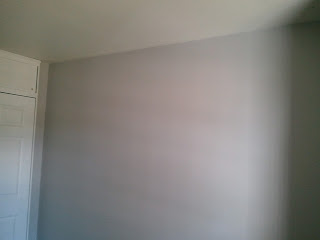
In order to click on white sliding door in this screenshot , I will do `click(21, 77)`.